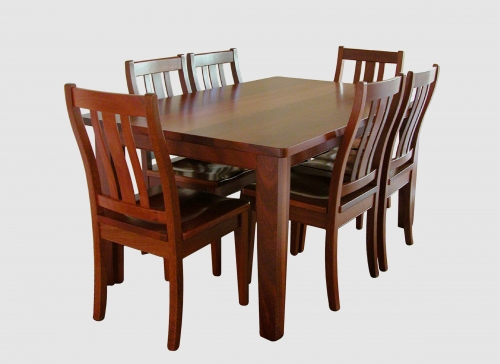
The height and width of the screenshot is (364, 500). In order to click on table in this screenshot , I will do `click(269, 123)`.